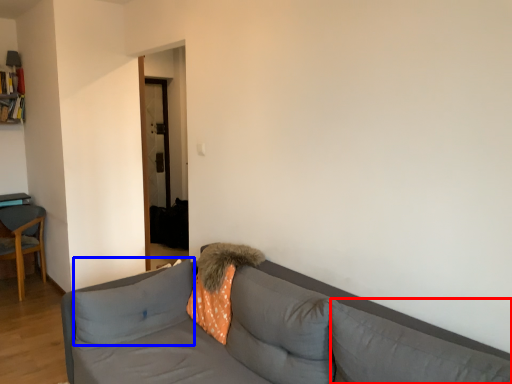
Question: Which object appears closest to the camera in this image, pillow (highlighted by a red box) or pillow (highlighted by a blue box)?

Choices:
 (A) pillow
 (B) pillow

Answer: (A)